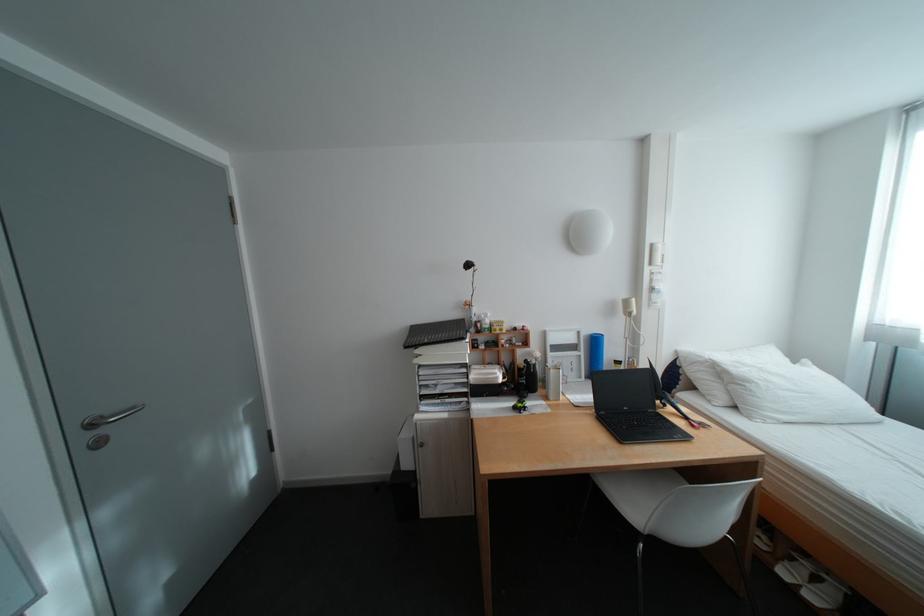
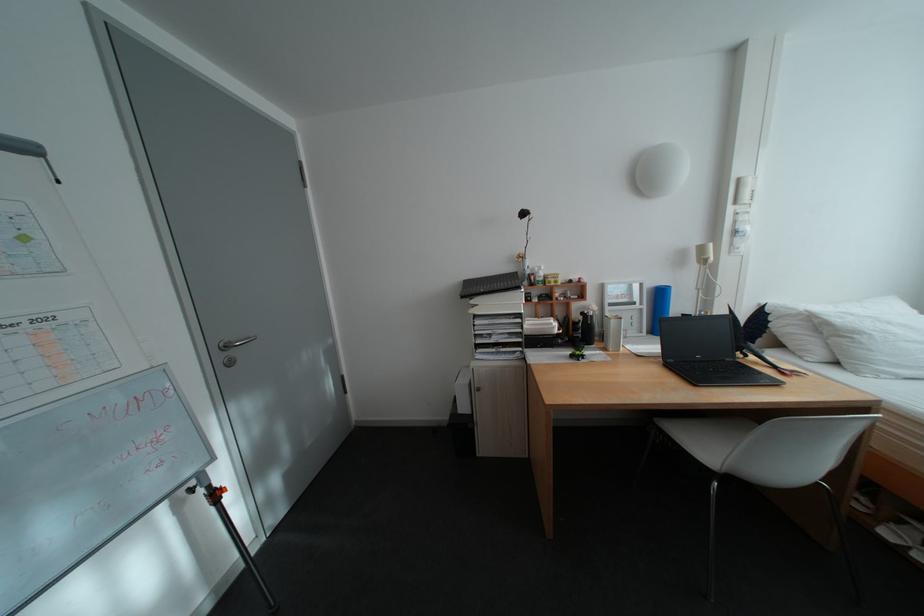
The point at [634,363] is marked in the first image. Where is the corresponding point in the second image?

(703, 315)